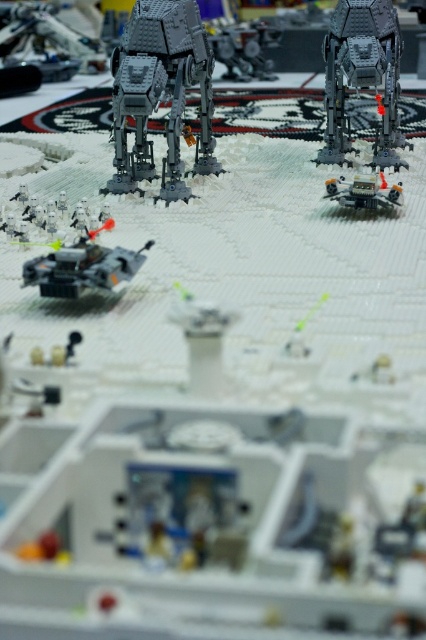
You are a Star Wars LEGO enthusiast who wants to recreate the distance between the dark gray metallic walker at upper right and the white matte soldiers at lower left in your own diorama. What is the exact distance you should maintain between them?

The dark gray metallic walker at upper right should be placed 24.79 inches away from the white matte soldiers at lower left to accurately recreate the distance shown in the image.

You are a Star Wars LEGO figure trying to hide from the metallic silver tank at center. You see the white matte soldiers at lower left nearby. Which object can you use for cover?

The white matte soldiers at lower left can be used for cover because they are much taller than the metallic silver tank at center, providing a better shield against the tank.

Based on the coordinates provided in the scene description, where is the dark gray metallic walker at upper right located?

The dark gray metallic walker at upper right is located at point (362,76).